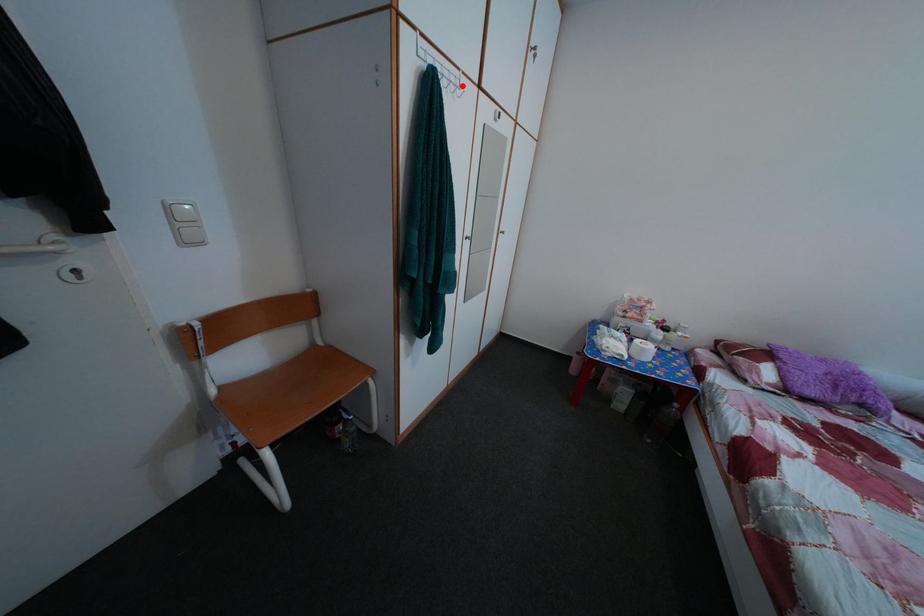
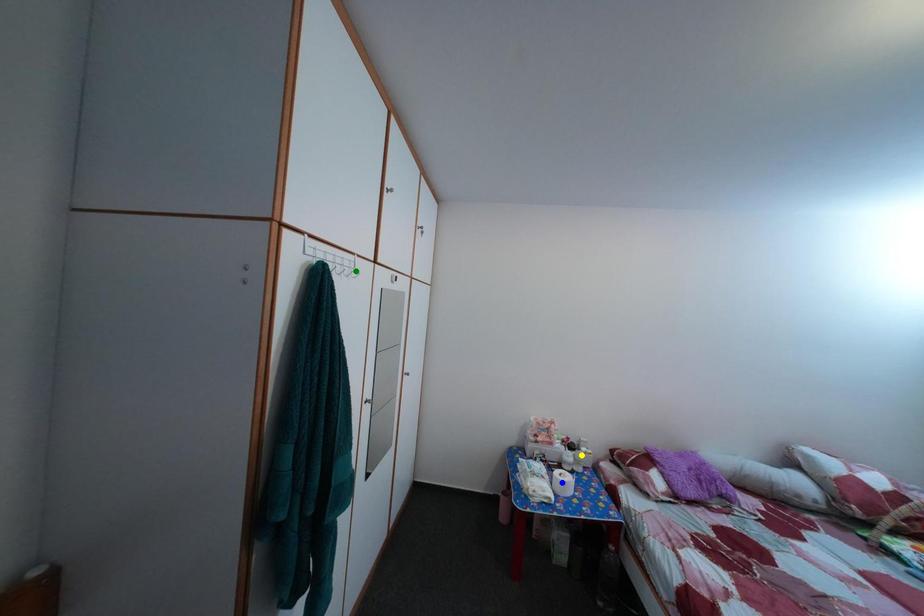
Question: I am providing you with two images of the same scene from different viewpoints. A red point is marked on the first image. You are given multiple points on the second image. Can you choose the point in image 2 that corresponds to the point in image 1?

Choices:
 (A) blue point
 (B) green point
 (C) yellow point

Answer: (B)